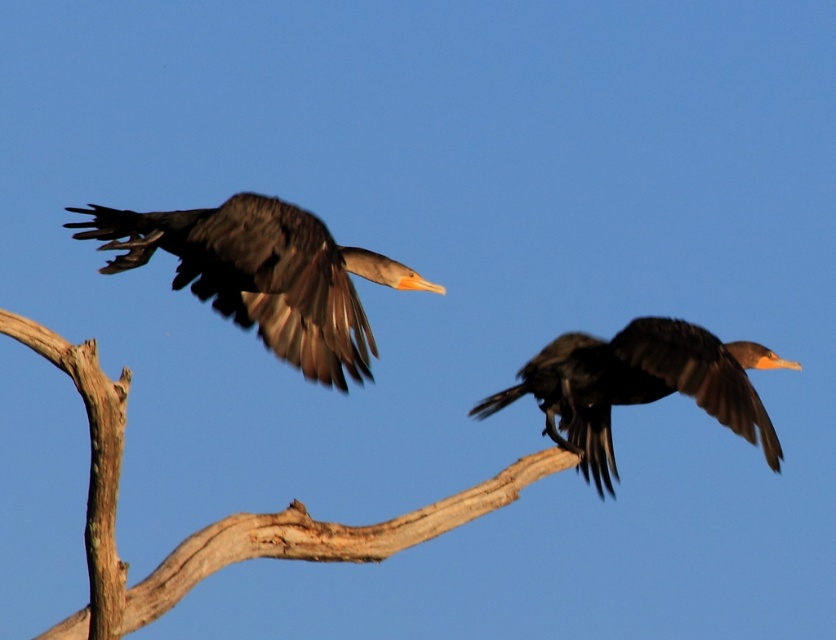
Which is more to the left, smooth wood branch at center or shiny black bird at center?

Positioned to the left is smooth wood branch at center.

The height and width of the screenshot is (640, 836). Describe the element at coordinates (227, 516) in the screenshot. I see `smooth wood branch at center` at that location.

Where is `smooth wood branch at center`? smooth wood branch at center is located at coordinates (227, 516).

Can you confirm if shiny black bird at left is smaller than shiny black bird at center?

Yes.

Consider the image. Is the position of shiny black bird at left more distant than that of shiny black bird at center?

No, shiny black bird at left is closer to the viewer.

Between point (299, 212) and point (580, 467), which one is positioned behind?

Point (580, 467)

Where is `shiny black bird at left`? The height and width of the screenshot is (640, 836). shiny black bird at left is located at coordinates click(x=263, y=275).

Can you confirm if smooth wood branch at center is positioned above shiny black bird at left?

No.

Does smooth wood branch at center have a lesser height compared to shiny black bird at left?

No, smooth wood branch at center is not shorter than shiny black bird at left.

Is point (554, 467) positioned before point (260, 257)?

That is False.

What are the coordinates of `smooth wood branch at center` in the screenshot? It's located at (227, 516).